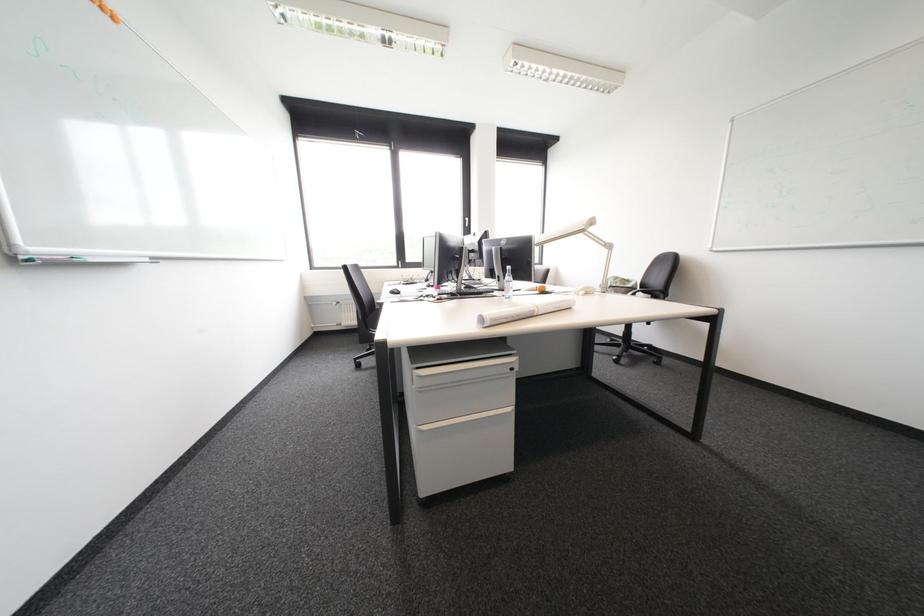
Find the location of a particular element. This screenshot has height=616, width=924. the bottom drawer handle is located at coordinates (464, 419).